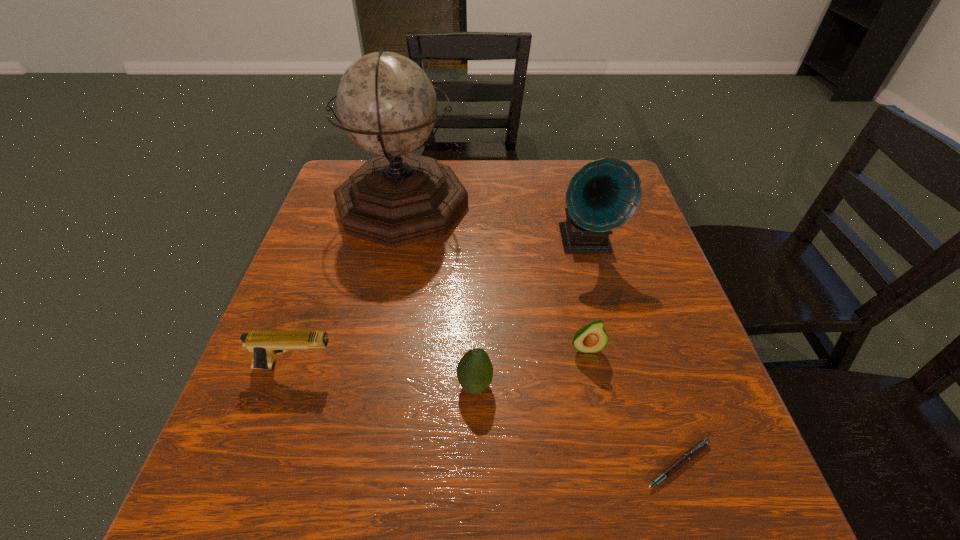
This screenshot has width=960, height=540. Find the location of `vacant space in between the tallest object and the pistol`. vacant space in between the tallest object and the pistol is located at coordinates (349, 286).

What are the coordinates of `vacant region between the pistol and the globe` in the screenshot? It's located at (349, 286).

Where is `free spot between the pistol and the globe`? This screenshot has width=960, height=540. free spot between the pistol and the globe is located at coordinates (349, 286).

Where is `blank region between the shortest object and the globe`? The height and width of the screenshot is (540, 960). blank region between the shortest object and the globe is located at coordinates (540, 334).

You are a GUI agent. You are given a task and a screenshot of the screen. Output one action in this format:
    pyautogui.click(x=<x>, y=<y>)
    Task: Click on the empty space that is in between the tallest object and the farther avocado
    Image resolution: width=960 pixels, height=540 pixels.
    Given the screenshot: What is the action you would take?
    pyautogui.click(x=494, y=276)

You are a GUI agent. You are given a task and a screenshot of the screen. Output one action in this format:
    pyautogui.click(x=<x>, y=<y>)
    Task: Click on the free space between the right avocado and the pistol
    The height and width of the screenshot is (540, 960).
    Given the screenshot: What is the action you would take?
    click(x=441, y=357)

Point out which object is positioned as the fifth nearest to the pistol. Please provide its 2D coordinates. Your answer should be formatted as a tuple, i.e. [(x, y)], where the tuple contains the x and y coordinates of a point satisfying the conditions above.

[(692, 452)]

Identify the location of the closest object to the globe. (604, 194).

Where is `free location that satisfies the following two spatial constraints: 1. on the cut side of the fourth nearest object; 2. at the barrel of the pistol`? The width and height of the screenshot is (960, 540). free location that satisfies the following two spatial constraints: 1. on the cut side of the fourth nearest object; 2. at the barrel of the pistol is located at coordinates (590, 367).

Identify the location of blank space that satisfies the following two spatial constraints: 1. at the barrel of the pistol; 2. on the back side of the left avocado. (290, 385).